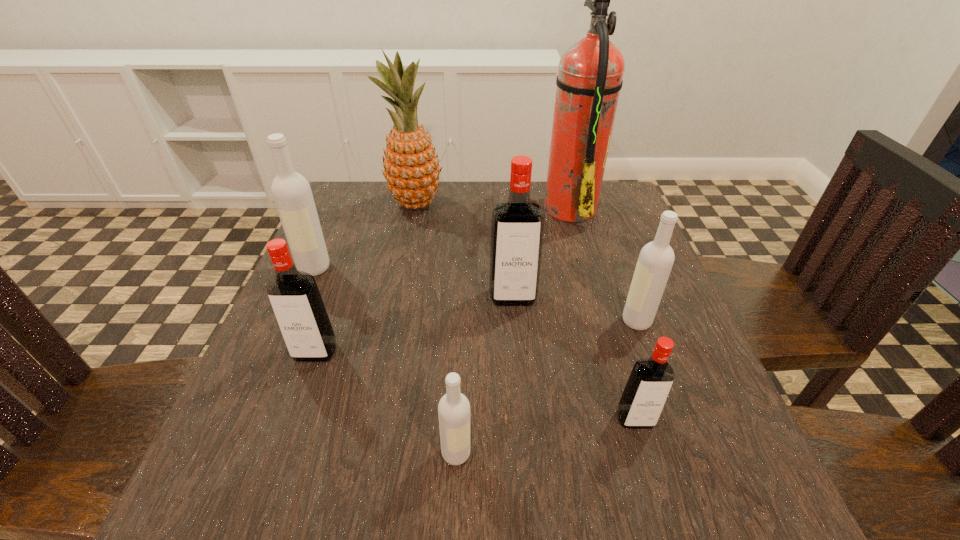
Identify the location of object that is at the far left corner. (411, 167).

Find the location of a particular element. This screenshot has height=540, width=960. object at the far right corner is located at coordinates (589, 80).

In order to click on vacant space at the far edge of the desktop in this screenshot , I will do (x=452, y=187).

Locate an element on the screen. This screenshot has height=540, width=960. vacant space at the near edge of the desktop is located at coordinates (513, 493).

Identify the location of blank area at the left edge. (276, 421).

The image size is (960, 540). I want to click on free spot at the right edge of the desktop, so click(x=685, y=455).

The width and height of the screenshot is (960, 540). In order to click on vacant point at the far left corner in this screenshot , I will do `click(356, 221)`.

The image size is (960, 540). What are the coordinates of `free space between the tallest object and the sixth nearest object` in the screenshot? It's located at (443, 237).

You are a GUI agent. You are given a task and a screenshot of the screen. Output one action in this format:
    pyautogui.click(x=<x>, y=<y>)
    Task: Click on the empty location between the second biggest white vodka and the nearest vodka
    The height and width of the screenshot is (540, 960).
    Given the screenshot: What is the action you would take?
    pyautogui.click(x=546, y=387)

At what (x,y) coordinates should I click in order to perform the action: click on unoccupied area between the nearest vodka and the rightmost vodka. Please return your answer as a coordinate pair (x, y). The width and height of the screenshot is (960, 540). Looking at the image, I should click on (546, 387).